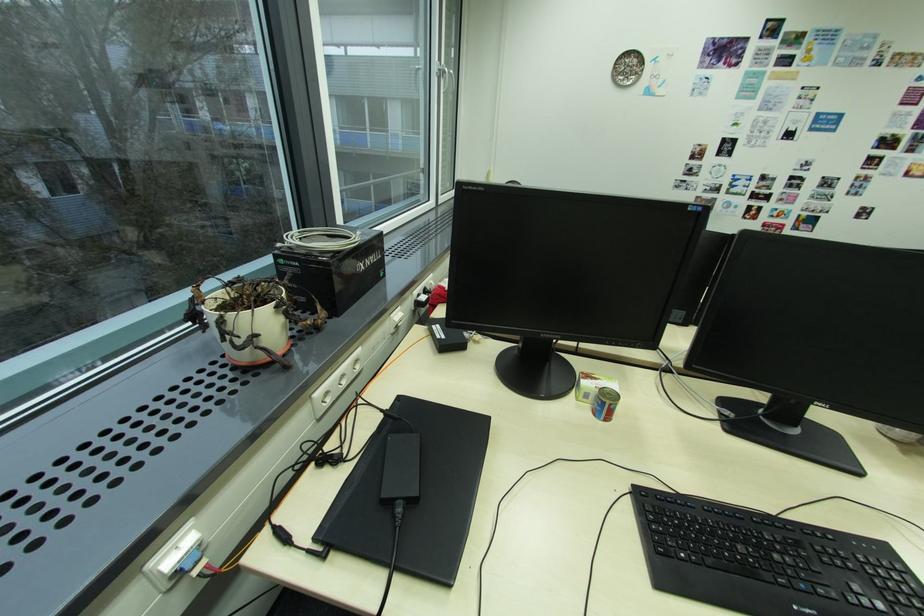
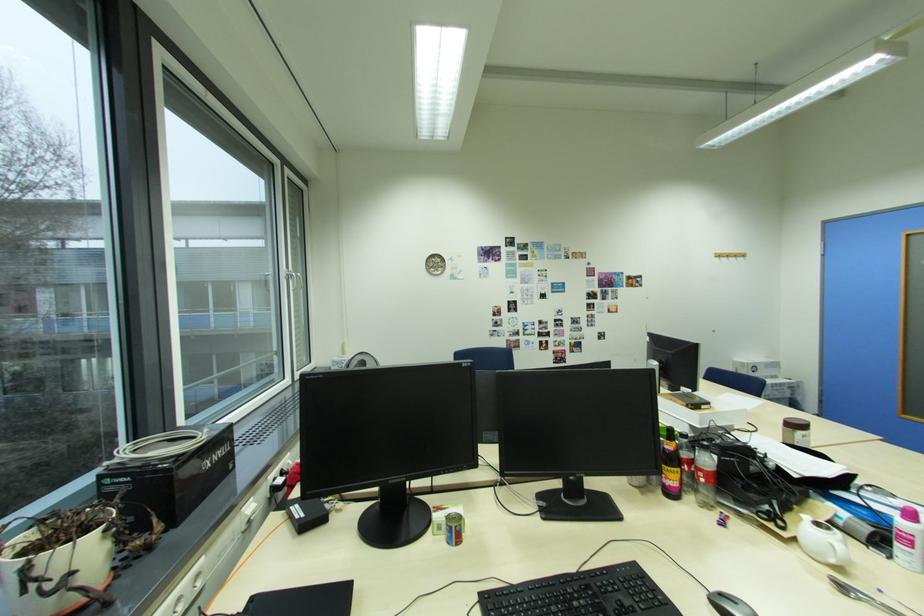
The point at (x=447, y=69) is marked in the first image. Where is the corresponding point in the second image?

(296, 274)